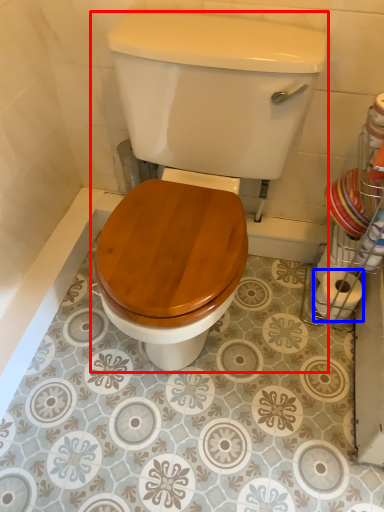
Question: Which of the following is the closest to the observer, toilet (highlighted by a red box) or toilet paper (highlighted by a blue box)?

Choices:
 (A) toilet
 (B) toilet paper

Answer: (A)